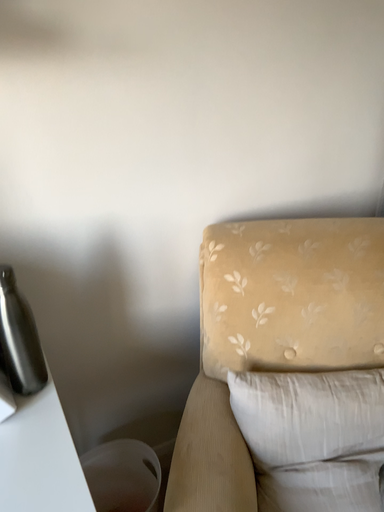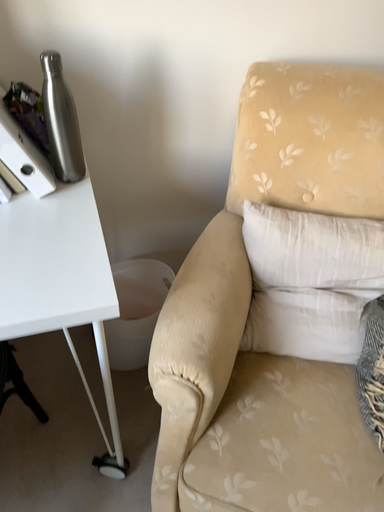
Question: Which way did the camera rotate in the video?

Choices:
 (A) rotated downward
 (B) rotated upward

Answer: (A)